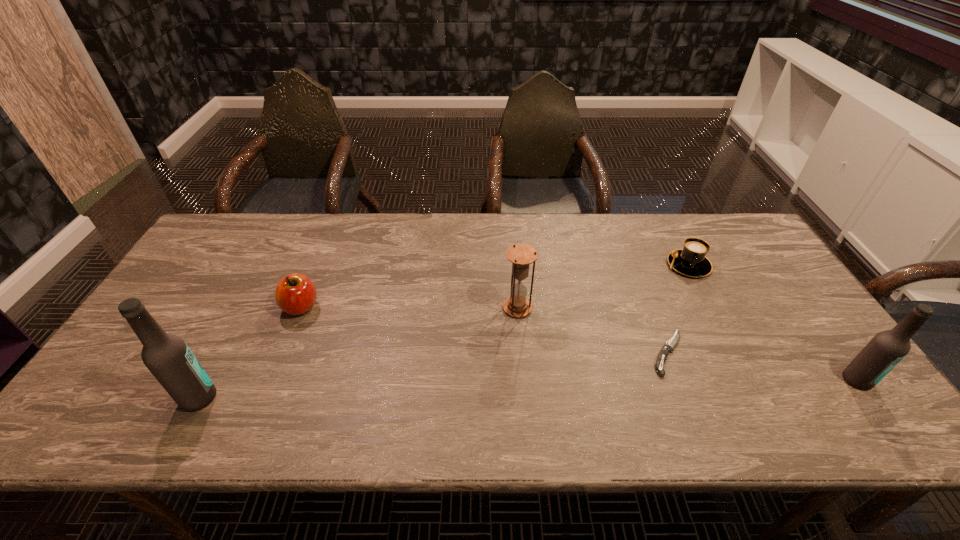
Locate an element on the screen. Image resolution: width=960 pixels, height=540 pixels. object present at the near right corner is located at coordinates (886, 349).

Where is `free space at the far edge of the desktop`? The width and height of the screenshot is (960, 540). free space at the far edge of the desktop is located at coordinates (367, 245).

The height and width of the screenshot is (540, 960). Find the location of `vacant region at the near edge of the desktop`. vacant region at the near edge of the desktop is located at coordinates (401, 388).

I want to click on vacant point at the left edge, so click(187, 343).

Where is `free space at the right edge of the desktop`? The height and width of the screenshot is (540, 960). free space at the right edge of the desktop is located at coordinates (756, 287).

Locate an element on the screen. The image size is (960, 540). blank space at the far left corner is located at coordinates (241, 238).

Identify the location of free area in between the farthest object and the shortest object. (678, 309).

Locate an element on the screen. The image size is (960, 540). blank region between the taller beer bottle and the fifth object from right to left is located at coordinates (250, 352).

Image resolution: width=960 pixels, height=540 pixels. Identify the location of free spot between the left beer bottle and the shortest object. (434, 375).

Find the location of a particular element. free space between the taller beer bottle and the shorter beer bottle is located at coordinates (528, 389).